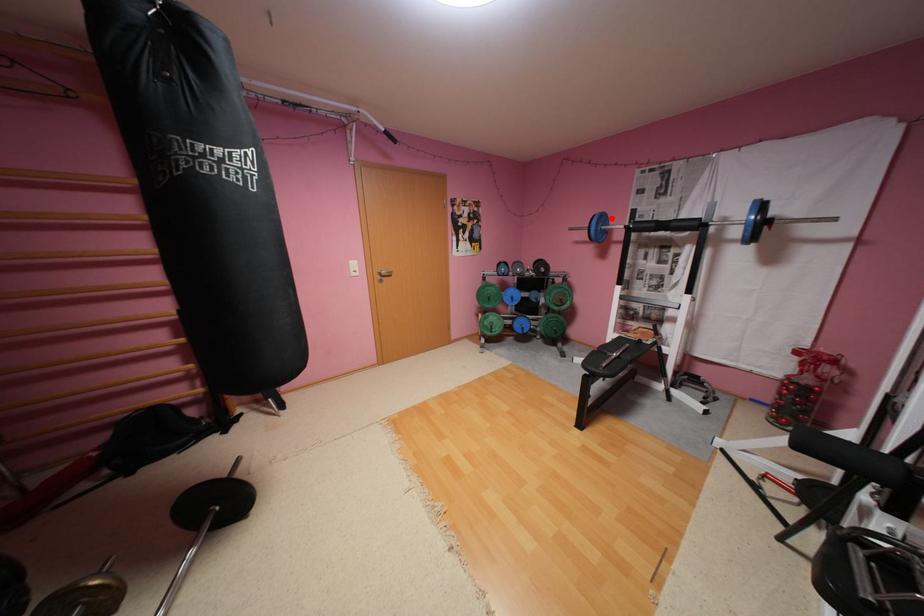
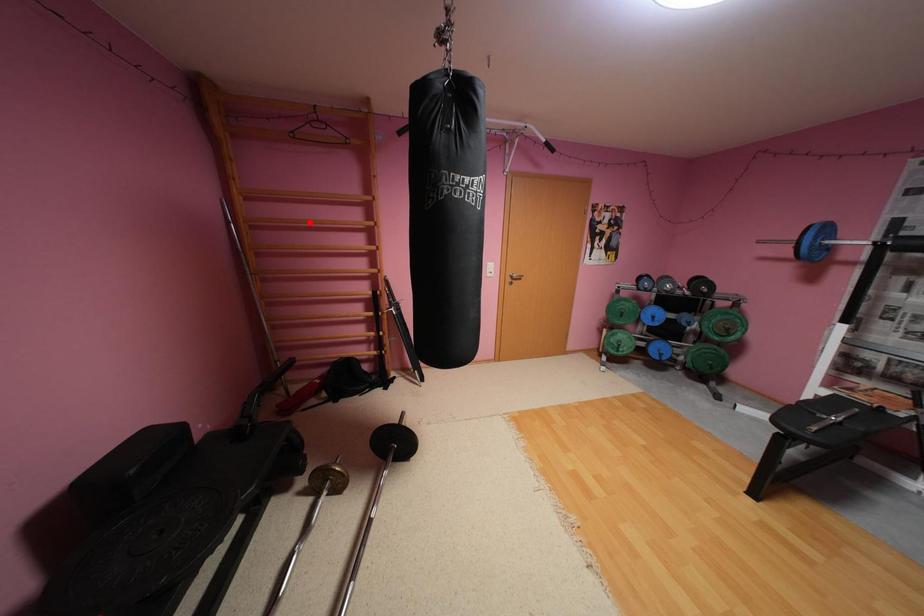
I am providing you with two images of the same scene from different viewpoints. A red point is marked on the first image and another point is marked on the second image. Is the red point in image1 aligned with the point shown in image2?

No